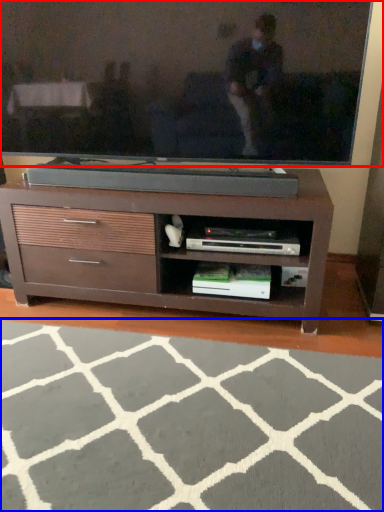
Question: Which of the following is the farthest to the observer, television (highlighted by a red box) or plain (highlighted by a blue box)?

Choices:
 (A) television
 (B) plain

Answer: (A)